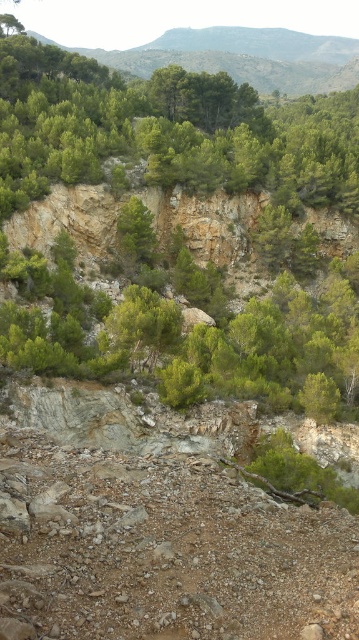
Based on the photo, you are hiking in this rugged landscape and want to take a photo of both the green matte tree at center and the green rough bark tree at center. Since you have a limited depth of field, which tree should you focus on to ensure both are in focus?

You should focus on the green rough bark tree at center because it is farther away, ensuring the green matte tree at center and the green rough bark tree at center are both within the depth of field.

You are hiking in this rugged landscape and want to take a photo of both the green matte tree at center and the green rough bark tree at center. Since you want both in the frame, which tree should you focus on first to ensure both are visible?

The green matte tree at center is located below the green rough bark tree at center, so you should focus on the green rough bark tree at center first to ensure both are visible in the frame.